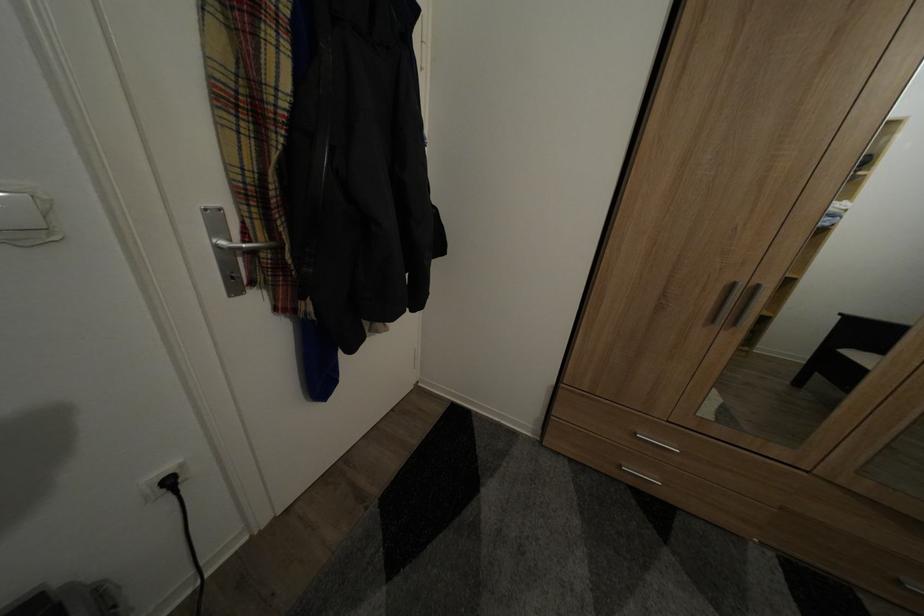
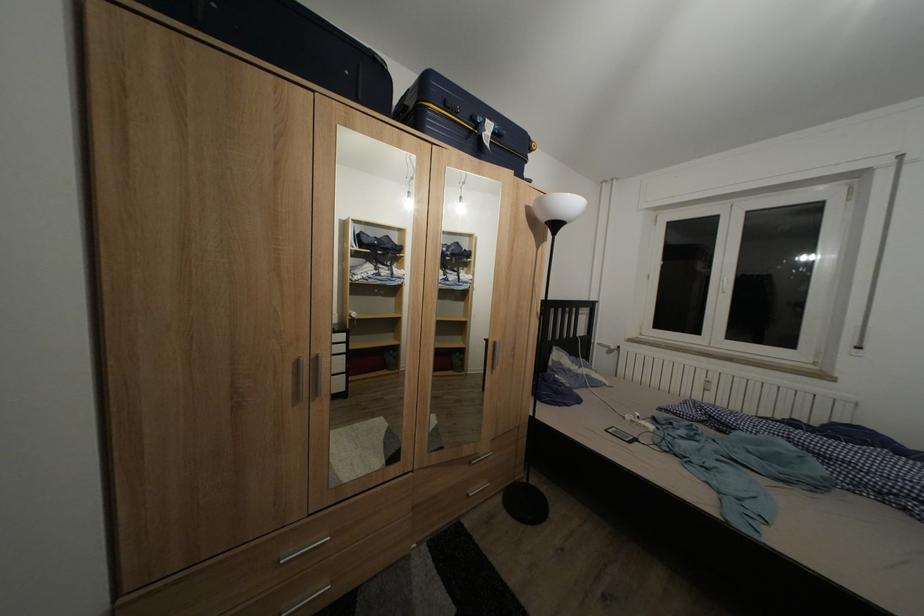
Question: How did the camera likely rotate?

Choices:
 (A) Left
 (B) Right
 (C) Up
 (D) Down

Answer: (B)